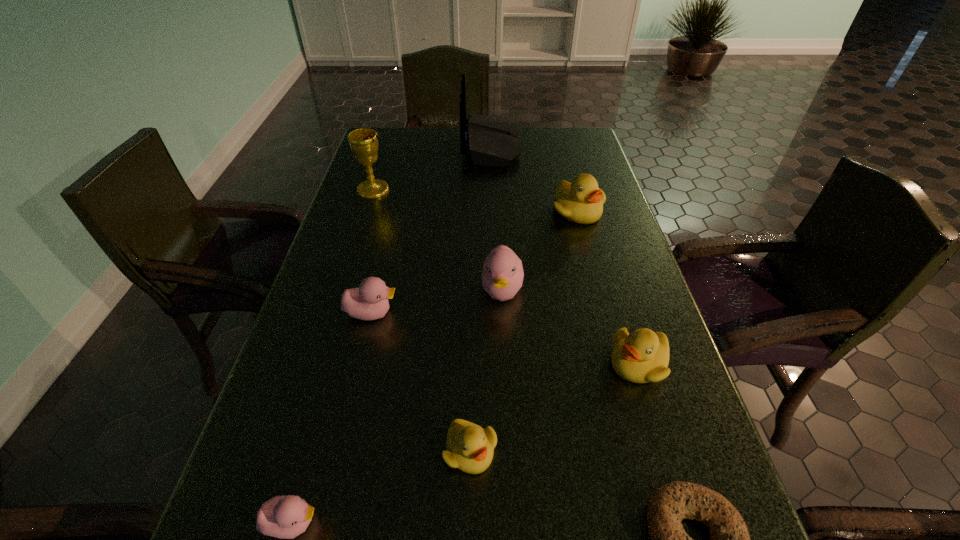
This screenshot has width=960, height=540. What are the coordinates of `the seventh farthest object` in the screenshot? It's located at (470, 448).

Where is `vacant space situated 0.290m on the back of the farthest object`? This screenshot has height=540, width=960. vacant space situated 0.290m on the back of the farthest object is located at coordinates (376, 146).

This screenshot has width=960, height=540. Find the location of `vacant position located on the back of the farthest object`. vacant position located on the back of the farthest object is located at coordinates (403, 146).

At what (x,y) coordinates should I click in order to perform the action: click on free spot located on the back of the farthest object. Please return your answer as a coordinate pair (x, y). Looking at the image, I should click on (426, 146).

Locate an element on the screen. vacant space located on the back of the gold chalice is located at coordinates (384, 156).

At what (x,y) coordinates should I click in order to perform the action: click on blank space located 0.110m on the front-facing side of the rightmost pink duckling. Please return your answer as a coordinate pair (x, y). Looking at the image, I should click on (505, 356).

Locate an element on the screen. The width and height of the screenshot is (960, 540). free space located on the front-facing side of the farthest duckling is located at coordinates (594, 273).

This screenshot has width=960, height=540. What are the coordinates of `free spot located on the front-facing side of the second biggest pink duckling` in the screenshot? It's located at (492, 313).

This screenshot has width=960, height=540. Find the location of `vacant space located on the front-facing side of the second nearest yellow duckling`. vacant space located on the front-facing side of the second nearest yellow duckling is located at coordinates (492, 363).

At what (x,y) coordinates should I click in order to perform the action: click on free space located 0.230m on the front-facing side of the second nearest yellow duckling. Please return your answer as a coordinate pair (x, y). Image resolution: width=960 pixels, height=540 pixels. Looking at the image, I should click on (492, 363).